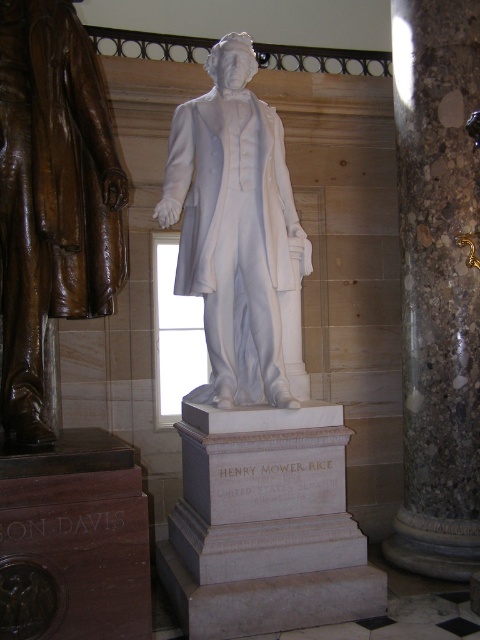
Question: Does marble column at right appear under bronze coat at left?

Choices:
 (A) yes
 (B) no

Answer: (A)

Question: Which point is closer to the camera?

Choices:
 (A) [418, 291]
 (B) [237, 273]

Answer: (B)

Question: Where is bronze coat at left located in relation to white marble statue at center in the image?

Choices:
 (A) above
 (B) below

Answer: (A)

Question: Is marble column at right thinner than bronze coat at left?

Choices:
 (A) no
 (B) yes

Answer: (A)

Question: Which point is farther from the camera taking this photo?

Choices:
 (A) (442, 8)
 (B) (240, 273)

Answer: (A)

Question: Which point is farther to the camera?

Choices:
 (A) (415, 88)
 (B) (214, 109)

Answer: (A)